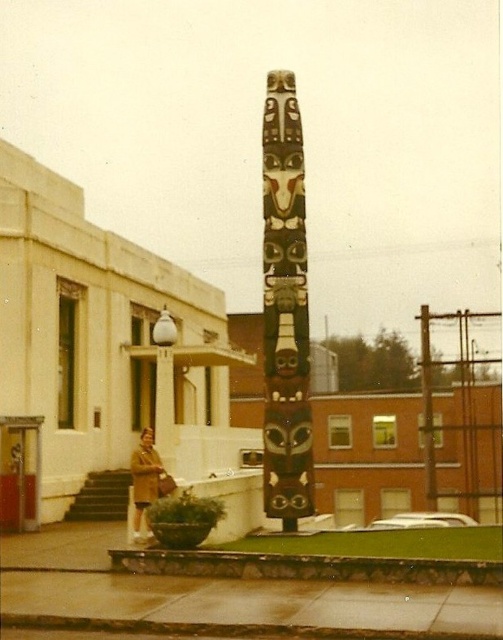
You are standing in the outdoor area and see the carved wood totem pole at center and the brown leather coat at lower left. Which object is positioned to the right of the other?

The carved wood totem pole at center is to the right of brown leather coat at lower left.

Consider the image. You are a photographer trying to capture both the carved wood totem pole at center and the brown leather coat at lower left in the same frame. Considering their sizes, which object should you focus on to ensure both are visible without cropping?

The carved wood totem pole at center is larger than the brown leather coat at lower left, so you should focus on the carved wood totem pole at center to ensure both are visible without cropping.

You are an artist planning to paint the scene. You want to ensure the proportions are accurate. Based on the image, which object is wider, the carved wood totem pole at center or the brown leather coat at lower left?

The brown leather coat at lower left is wider than the carved wood totem pole at center.